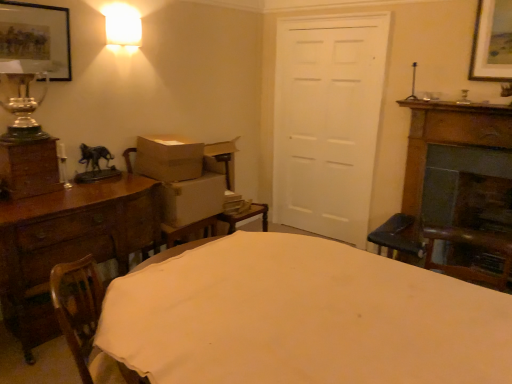
This screenshot has width=512, height=384. I want to click on vacant area on top of wooden chest of drawers at left (from a real-world perspective), so click(x=62, y=198).